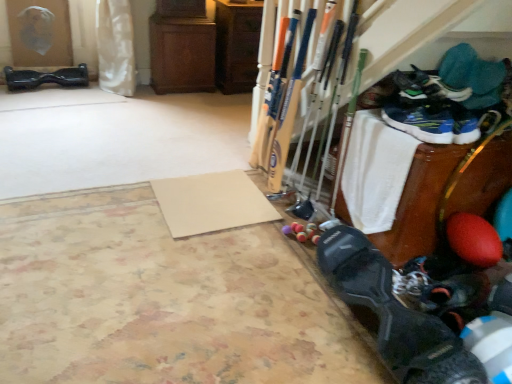
Question: Is green suede sneakers at upper right, which is counted as the third footwear, starting from the top, turned away from beige textured yoga mat at lower left, the 1th yoga mat when ordered from front to back?

Choices:
 (A) yes
 (B) no

Answer: (B)

Question: Considering the relative positions of green suede sneakers at upper right, acting as the fourth footwear starting from the bottom, and beige textured yoga mat at lower left, which is the 2th yoga mat from back to front, in the image provided, is green suede sneakers at upper right, acting as the fourth footwear starting from the bottom, to the left of beige textured yoga mat at lower left, which is the 2th yoga mat from back to front, from the viewer's perspective?

Choices:
 (A) yes
 (B) no

Answer: (B)

Question: Is the position of green suede sneakers at upper right, acting as the third footwear starting from the left, more distant than that of beige textured yoga mat at lower left, which is the 2th yoga mat from back to front?

Choices:
 (A) yes
 (B) no

Answer: (A)

Question: Does green suede sneakers at upper right, which is the 3th footwear from front to back, contain beige textured yoga mat at lower left, the 1th yoga mat when ordered from front to back?

Choices:
 (A) no
 (B) yes

Answer: (A)

Question: Considering the relative sizes of green suede sneakers at upper right, which is the fourth footwear from back to front, and beige textured yoga mat at lower left, the 1th yoga mat when ordered from front to back, in the image provided, is green suede sneakers at upper right, which is the fourth footwear from back to front, smaller than beige textured yoga mat at lower left, the 1th yoga mat when ordered from front to back,?

Choices:
 (A) no
 (B) yes

Answer: (B)

Question: Could you tell me if green suede sneakers at upper right, which is the fourth footwear from back to front, is facing beige textured yoga mat at lower left, which is the 2th yoga mat from back to front?

Choices:
 (A) yes
 (B) no

Answer: (B)

Question: Is green suede sneakers at upper right, which is the 4th footwear from right to left, not close to black matte shoe at lower right, positioned as the 5th footwear in back-to-front order?

Choices:
 (A) yes
 (B) no

Answer: (B)

Question: Is green suede sneakers at upper right, acting as the fourth footwear starting from the bottom, closer to the viewer compared to black matte shoe at lower right, positioned as the 5th footwear in back-to-front order?

Choices:
 (A) no
 (B) yes

Answer: (A)

Question: From a real-world perspective, is green suede sneakers at upper right, acting as the fourth footwear starting from the bottom, below black matte shoe at lower right, which is counted as the 2th footwear, starting from the front?

Choices:
 (A) yes
 (B) no

Answer: (B)

Question: Can you confirm if green suede sneakers at upper right, acting as the fourth footwear starting from the bottom, is smaller than black matte shoe at lower right, which is counted as the 2th footwear, starting from the front?

Choices:
 (A) yes
 (B) no

Answer: (B)

Question: From the image's perspective, is green suede sneakers at upper right, which is the fourth footwear from back to front, under black matte shoe at lower right, which appears as the 5th footwear when viewed from the left?

Choices:
 (A) yes
 (B) no

Answer: (B)

Question: Is the surface of green suede sneakers at upper right, which is the 4th footwear from right to left, in direct contact with black matte shoe at lower right, which is counted as the 2th footwear, starting from the front?

Choices:
 (A) yes
 (B) no

Answer: (B)

Question: Is the depth of blue mesh sneakers at lower right, the third footwear when ordered from back to front, greater than that of blue synthetic shoe at upper right, marked as the first footwear in a right-to-left arrangement?

Choices:
 (A) no
 (B) yes

Answer: (A)